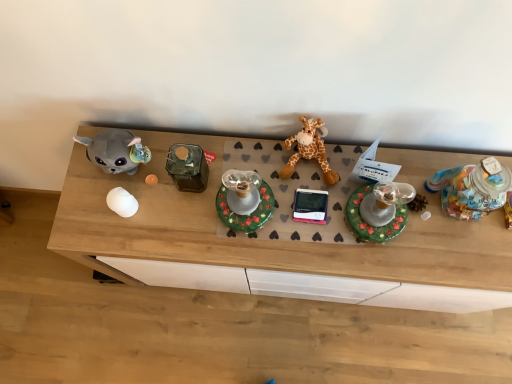
Question: Should I look upward or downward to see wooden desk at center?

Choices:
 (A) up
 (B) down

Answer: (B)

Question: Is white glossy egg at center, which is the first toy from left to right, closer to the viewer compared to orange plush giraffe at center?

Choices:
 (A) yes
 (B) no

Answer: (B)

Question: Is white glossy egg at center, which is the first toy from left to right, far from orange plush giraffe at center?

Choices:
 (A) no
 (B) yes

Answer: (A)

Question: Could you tell me if white glossy egg at center, which is the first toy from left to right, is facing orange plush giraffe at center?

Choices:
 (A) no
 (B) yes

Answer: (A)

Question: Is white glossy egg at center, acting as the 4th toy starting from the right, completely or partially outside of orange plush giraffe at center?

Choices:
 (A) yes
 (B) no

Answer: (A)

Question: From a real-world perspective, is white glossy egg at center, which is the first toy from left to right, over orange plush giraffe at center?

Choices:
 (A) no
 (B) yes

Answer: (A)

Question: Is white glossy egg at center, which is the first toy from left to right, smaller than orange plush giraffe at center?

Choices:
 (A) no
 (B) yes

Answer: (B)

Question: From a real-world perspective, does wooden desk at center stand above green matte candle holder at center, placed as the second toy when sorted from left to right?

Choices:
 (A) no
 (B) yes

Answer: (A)

Question: Is wooden desk at center located outside green matte candle holder at center, placed as the second toy when sorted from left to right?

Choices:
 (A) yes
 (B) no

Answer: (A)

Question: From the image's perspective, would you say wooden desk at center is shown under green matte candle holder at center, placed as the second toy when sorted from left to right?

Choices:
 (A) yes
 (B) no

Answer: (A)

Question: Is wooden desk at center facing towards green matte candle holder at center, placed as the second toy when sorted from left to right?

Choices:
 (A) yes
 (B) no

Answer: (B)

Question: From the image's perspective, is wooden desk at center on green matte candle holder at center, which is the third toy from right to left?

Choices:
 (A) yes
 (B) no

Answer: (B)

Question: Does wooden desk at center come in front of green matte candle holder at center, placed as the second toy when sorted from left to right?

Choices:
 (A) no
 (B) yes

Answer: (A)

Question: From a real-world perspective, is orange plush giraffe at center under white glossy egg at center, acting as the 4th toy starting from the right?

Choices:
 (A) no
 (B) yes

Answer: (A)